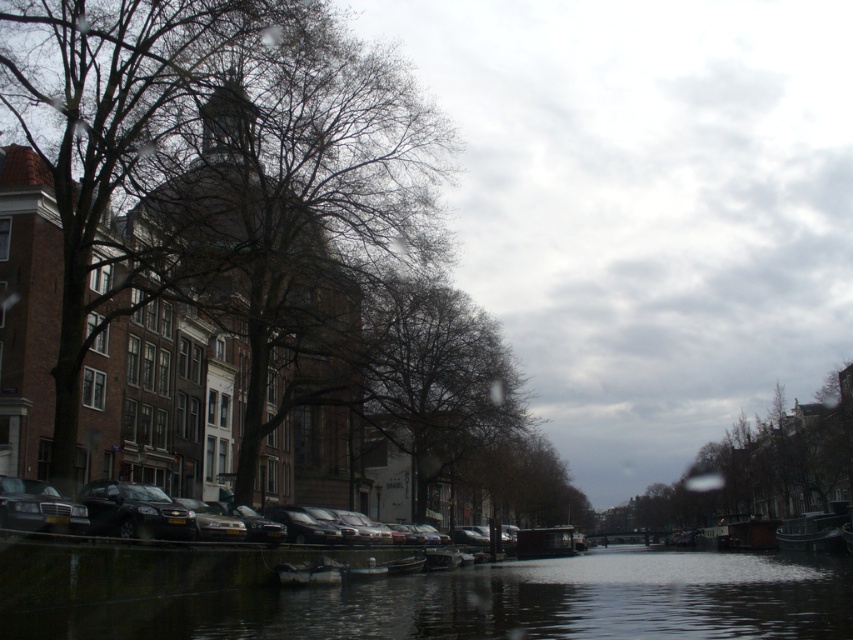
You are a delivery drone flying over the canal scene. You need to land on the dark reflective water at center but must avoid the bare branches at center. Is there enough space between them to land safely?

The dark reflective water at center might be wider than the bare branches at center, so there could be sufficient space to land safely. However, since the exact width difference isn not specified, proceed with caution.

You are standing on the sidewalk next to the canal and want to take a photo of the shiny black car at lower center without including the brown textured building at left in the frame. Which direction should you move to achieve this?

Move to the right side of the shiny black car at lower center so that the brown textured building at left is out of the frame.